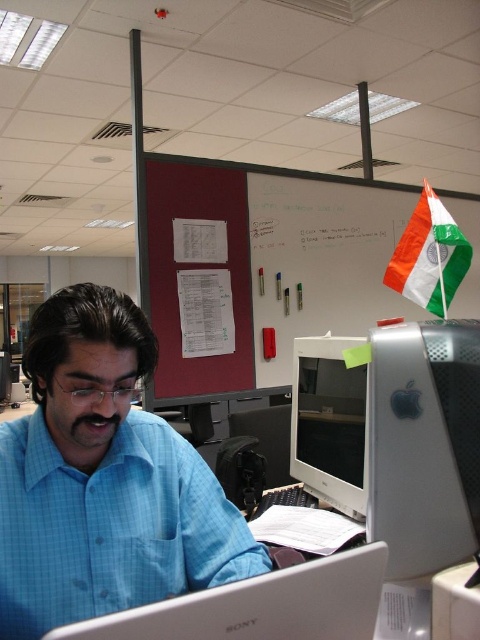
Does matte blue laptop at lower center have a greater height compared to white fabric flag at upper right?

Incorrect, matte blue laptop at lower center's height is not larger of white fabric flag at upper right's.

Is matte blue laptop at lower center to the right of white fabric flag at upper right from the viewer's perspective?

Incorrect, matte blue laptop at lower center is not on the right side of white fabric flag at upper right.

Is point (196, 618) farther from viewer compared to point (444, 296)?

No, it is in front of (444, 296).

Locate an element on the screen. The height and width of the screenshot is (640, 480). matte blue laptop at lower center is located at coordinates (261, 605).

Does blue checkered shirt at center have a greater width compared to white fabric flag at upper right?

Indeed, blue checkered shirt at center has a greater width compared to white fabric flag at upper right.

Is blue checkered shirt at center above white fabric flag at upper right?

No, blue checkered shirt at center is not above white fabric flag at upper right.

Locate an element on the screen. Image resolution: width=480 pixels, height=640 pixels. blue checkered shirt at center is located at coordinates (104, 480).

At what (x,y) coordinates should I click in order to perform the action: click on blue checkered shirt at center. Please return your answer as a coordinate pair (x, y). This screenshot has width=480, height=640. Looking at the image, I should click on (104, 480).

Between maroon fabric bulletin board at upper center and matte blue laptop at lower center, which one appears on the left side from the viewer's perspective?

matte blue laptop at lower center

The height and width of the screenshot is (640, 480). Identify the location of maroon fabric bulletin board at upper center. (271, 262).

Locate an element on the screen. Image resolution: width=480 pixels, height=640 pixels. maroon fabric bulletin board at upper center is located at coordinates (271, 262).